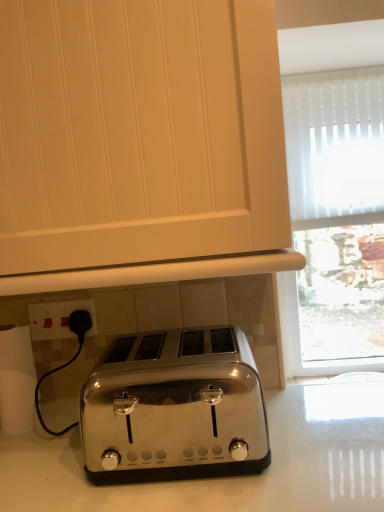
Where is `white plastic switch at lower left`? Image resolution: width=384 pixels, height=512 pixels. white plastic switch at lower left is located at coordinates (58, 318).

What is the approximate height of white plastic switch at lower left?

3.45 inches.

Find the location of a particular element. white paper towel at lower left is located at coordinates (16, 379).

What do you see at coordinates (174, 408) in the screenshot? Image resolution: width=384 pixels, height=512 pixels. I see `satin chrome toaster at center` at bounding box center [174, 408].

At what (x,y) coordinates should I click in order to perform the action: click on satin chrome toaster at center. Please return your answer as a coordinate pair (x, y). Looking at the image, I should click on (174, 408).

You are a GUI agent. You are given a task and a screenshot of the screen. Output one action in this format:
    pyautogui.click(x=<x>, y=<y>)
    Task: Click on the satin chrome toaster at lower center
    Image resolution: width=384 pixels, height=512 pixels.
    Given the screenshot: What is the action you would take?
    [139, 133]

Is satin chrome toaster at center positioned beyond the bounds of satin chrome toaster at lower center?

Yes, satin chrome toaster at center is not within satin chrome toaster at lower center.

Which is behind, satin chrome toaster at center or satin chrome toaster at lower center?

satin chrome toaster at center is further from the camera.

This screenshot has width=384, height=512. In order to click on toaster lying on the right of satin chrome toaster at lower center in this screenshot , I will do `click(174, 408)`.

Which is behind, point (186, 467) or point (77, 212)?

Point (186, 467)

Is satin chrome toaster at center closer to the viewer compared to white paper towel at lower left?

Yes, satin chrome toaster at center is in front of white paper towel at lower left.

Considering the points (163, 441) and (30, 378), which point is behind, point (163, 441) or point (30, 378)?

The point (30, 378) is farther from the camera.

Is white paper towel at lower left at the back of satin chrome toaster at center?

No, satin chrome toaster at center is not facing the opposite direction of white paper towel at lower left.

Are satin chrome toaster at center and white paper towel at lower left located far from each other?

satin chrome toaster at center is actually quite close to white paper towel at lower left.

Can you tell me how much satin chrome toaster at lower center and satin chrome toaster at center differ in facing direction?

The angular difference between satin chrome toaster at lower center and satin chrome toaster at center is 1.47 degrees.

Identify the location of toaster below the satin chrome toaster at lower center (from the image's perspective). The height and width of the screenshot is (512, 384). (174, 408).

Is satin chrome toaster at lower center not close to satin chrome toaster at center?

Actually, satin chrome toaster at lower center and satin chrome toaster at center are a little close together.

Is satin chrome toaster at lower center closer to the viewer compared to satin chrome toaster at center?

Yes.

Locate an element on the screen. The height and width of the screenshot is (512, 384). oven in front of the white paper towel at lower left is located at coordinates [139, 133].

Is white paper towel at lower left oriented towards satin chrome toaster at lower center?

No, white paper towel at lower left is not oriented towards satin chrome toaster at lower center.

Considering the relative sizes of white paper towel at lower left and satin chrome toaster at lower center in the image provided, is white paper towel at lower left bigger than satin chrome toaster at lower center?

Incorrect, white paper towel at lower left is not larger than satin chrome toaster at lower center.

From the image's perspective, which object appears higher, white paper towel at lower left or satin chrome toaster at lower center?

satin chrome toaster at lower center.

Considering the points (39, 317) and (16, 429), which point is in front, point (39, 317) or point (16, 429)?

The point (16, 429) is closer.

Looking at this image, how different are the orientations of white plastic switch at lower left and white paper towel at lower left in degrees?

2 degrees.

Where is `toilet paper directly beneath the white plastic switch at lower left (from a real-world perspective)`? This screenshot has height=512, width=384. toilet paper directly beneath the white plastic switch at lower left (from a real-world perspective) is located at coordinates (16, 379).

Measure the distance from white plastic switch at lower left to white paper towel at lower left.

white plastic switch at lower left and white paper towel at lower left are 4.52 inches apart from each other.

From a real-world perspective, is white plastic switch at lower left positioned over satin chrome toaster at center based on gravity?

Yes.

Is white plastic switch at lower left situated inside satin chrome toaster at center or outside?

white plastic switch at lower left is spatially situated outside satin chrome toaster at center.

Between white plastic switch at lower left and satin chrome toaster at center, which one is positioned behind?

white plastic switch at lower left.

In terms of width, does satin chrome toaster at lower center look wider or thinner when compared to white plastic switch at lower left?

satin chrome toaster at lower center is wider than white plastic switch at lower left.

Is point (254, 138) in front of point (40, 321)?

That is True.

Who is smaller, satin chrome toaster at lower center or white plastic switch at lower left?

white plastic switch at lower left.

Is the position of satin chrome toaster at lower center less distant than that of white plastic switch at lower left?

Yes, satin chrome toaster at lower center is in front of white plastic switch at lower left.

You are a GUI agent. You are given a task and a screenshot of the screen. Output one action in this format:
    pyautogui.click(x=<x>, y=<y>)
    Task: Click on the toaster on the right of the satin chrome toaster at lower center
    
    Given the screenshot: What is the action you would take?
    pyautogui.click(x=174, y=408)

Find the location of a particular element. This screenshot has height=512, width=384. toaster that is above the white paper towel at lower left (from the image's perspective) is located at coordinates (174, 408).

From the image, which object appears to be nearer to white plastic switch at lower left, satin chrome toaster at center or satin chrome toaster at lower center?

The object closer to white plastic switch at lower left is satin chrome toaster at center.

When comparing their distances from satin chrome toaster at center, does satin chrome toaster at lower center or white plastic switch at lower left seem further?

satin chrome toaster at lower center is positioned further to the anchor satin chrome toaster at center.

Looking at the image, which one is located closer to white plastic switch at lower left, white paper towel at lower left or satin chrome toaster at lower center?

white paper towel at lower left is positioned closer to the anchor white plastic switch at lower left.

From the image, which object appears to be nearer to satin chrome toaster at lower center, satin chrome toaster at center or white paper towel at lower left?

satin chrome toaster at center lies closer to satin chrome toaster at lower center than the other object.

Looking at the image, which one is located further to white paper towel at lower left, white plastic switch at lower left or satin chrome toaster at center?

Based on the image, satin chrome toaster at center appears to be further to white paper towel at lower left.

Considering their positions, is satin chrome toaster at lower center positioned closer to white paper towel at lower left than satin chrome toaster at center?

A: satin chrome toaster at center lies closer to white paper towel at lower left than the other object.

Estimate the real-world distances between objects in this image. Which object is closer to white paper towel at lower left, white plastic switch at lower left or satin chrome toaster at lower center?

Based on the image, white plastic switch at lower left appears to be nearer to white paper towel at lower left.

Considering their positions, is satin chrome toaster at center positioned closer to white paper towel at lower left than satin chrome toaster at lower center?

Based on the image, satin chrome toaster at center appears to be nearer to white paper towel at lower left.

The image size is (384, 512). I want to click on electric outlet between satin chrome toaster at lower center and satin chrome toaster at center vertically, so click(58, 318).

The image size is (384, 512). I want to click on toaster between satin chrome toaster at lower center and white paper towel at lower left vertically, so click(174, 408).

You are a GUI agent. You are given a task and a screenshot of the screen. Output one action in this format:
    pyautogui.click(x=<x>, y=<y>)
    Task: Click on the electric outlet between satin chrome toaster at lower center and white paper towel at lower left vertically
    This screenshot has height=512, width=384.
    Given the screenshot: What is the action you would take?
    pyautogui.click(x=58, y=318)

This screenshot has height=512, width=384. I want to click on electric outlet located between white paper towel at lower left and satin chrome toaster at center in the left-right direction, so click(x=58, y=318).